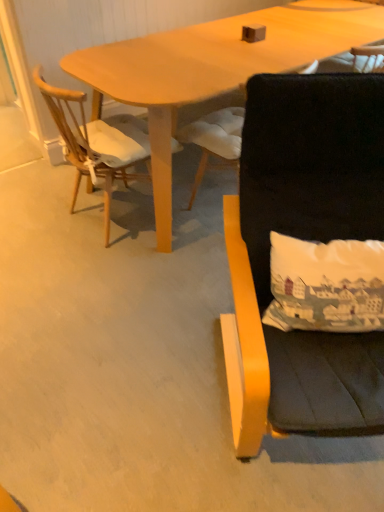
Question: Can you confirm if wooden chair at left, which is counted as the third chair, starting from the right, is positioned to the left of black fabric chair at center, which ranks as the 2th chair in left-to-right order?

Choices:
 (A) yes
 (B) no

Answer: (A)

Question: Can you confirm if wooden chair at left, which is counted as the third chair, starting from the right, is wider than black fabric chair at center, which is the second chair in right-to-left order?

Choices:
 (A) no
 (B) yes

Answer: (B)

Question: Considering the relative positions of wooden chair at left, marked as the 1th chair in a left-to-right arrangement, and black fabric chair at center, which ranks as the 2th chair in left-to-right order, in the image provided, is wooden chair at left, marked as the 1th chair in a left-to-right arrangement, in front of black fabric chair at center, which ranks as the 2th chair in left-to-right order,?

Choices:
 (A) yes
 (B) no

Answer: (A)

Question: From a real-world perspective, is wooden chair at left, marked as the 1th chair in a left-to-right arrangement, positioned over black fabric chair at center, which ranks as the 2th chair in left-to-right order, based on gravity?

Choices:
 (A) yes
 (B) no

Answer: (A)

Question: Is black fabric chair at center, which is the second chair in right-to-left order, at the back of wooden chair at left, marked as the 1th chair in a left-to-right arrangement?

Choices:
 (A) no
 (B) yes

Answer: (A)

Question: Is black fabric chair at center, which ranks as the 2th chair in left-to-right order, to the left or to the right of black fabric chair at right, which ranks as the 3th chair in left-to-right order, in the image?

Choices:
 (A) right
 (B) left

Answer: (B)

Question: From a real-world perspective, is black fabric chair at center, which is the second chair in right-to-left order, physically located above or below black fabric chair at right, which ranks as the 3th chair in left-to-right order?

Choices:
 (A) above
 (B) below

Answer: (B)

Question: In terms of width, does black fabric chair at center, which is the second chair in right-to-left order, look wider or thinner when compared to black fabric chair at right, which ranks as the first chair in right-to-left order?

Choices:
 (A) thin
 (B) wide

Answer: (A)

Question: From the image's perspective, is black fabric chair at center, which is the second chair in right-to-left order, positioned above or below black fabric chair at right, which ranks as the 3th chair in left-to-right order?

Choices:
 (A) above
 (B) below

Answer: (A)

Question: From their relative heights in the image, would you say black fabric chair at right, which ranks as the 3th chair in left-to-right order, is taller or shorter than black fabric chair at center, which is the second chair in right-to-left order?

Choices:
 (A) short
 (B) tall

Answer: (B)

Question: From the image's perspective, is black fabric chair at right, which ranks as the 3th chair in left-to-right order, above or below black fabric chair at center, which is the second chair in right-to-left order?

Choices:
 (A) below
 (B) above

Answer: (A)

Question: Is point (248, 129) closer or farther from the camera than point (193, 130)?

Choices:
 (A) farther
 (B) closer

Answer: (B)

Question: Looking at their shapes, would you say black fabric chair at right, which ranks as the 3th chair in left-to-right order, is wider or thinner than black fabric chair at center, which is the second chair in right-to-left order?

Choices:
 (A) wide
 (B) thin

Answer: (A)

Question: In terms of height, does wooden chair at left, marked as the 1th chair in a left-to-right arrangement, look taller or shorter compared to black fabric chair at right, which ranks as the first chair in right-to-left order?

Choices:
 (A) short
 (B) tall

Answer: (A)

Question: Does point (54, 111) appear closer or farther from the camera than point (276, 112)?

Choices:
 (A) farther
 (B) closer

Answer: (A)